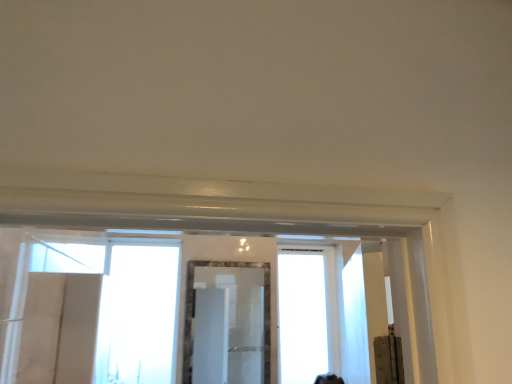
Question: Considering the positions of transparent glass window at center, the first window positioned from the right, and transparent glass window at center, positioned as the 2th window in right-to-left order, in the image, is transparent glass window at center, the first window positioned from the right, wider or thinner than transparent glass window at center, positioned as the 2th window in right-to-left order,?

Choices:
 (A) wide
 (B) thin

Answer: (A)

Question: Is transparent glass window at center, which ranks as the second window in left-to-right order, situated inside transparent glass window at center, which is counted as the 1th window, starting from the left, or outside?

Choices:
 (A) outside
 (B) inside

Answer: (A)

Question: Considering the real-world distances, which object is farthest from the transparent glass window at center, positioned as the 2th window in right-to-left order?

Choices:
 (A) marble frame mirror at center
 (B) transparent glass window at center, the first window positioned from the right

Answer: (B)

Question: Which object is positioned closest to the transparent glass window at center, which ranks as the second window in left-to-right order?

Choices:
 (A) marble frame mirror at center
 (B) transparent glass window at center, which is counted as the 1th window, starting from the left

Answer: (A)